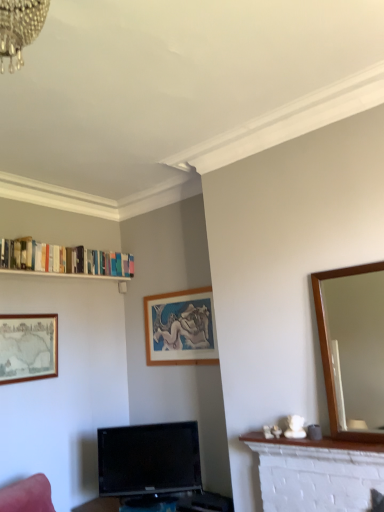
Locate an element on the screen. free spot above wooden mirror at right (from a real-world perspective) is located at coordinates coord(349,260).